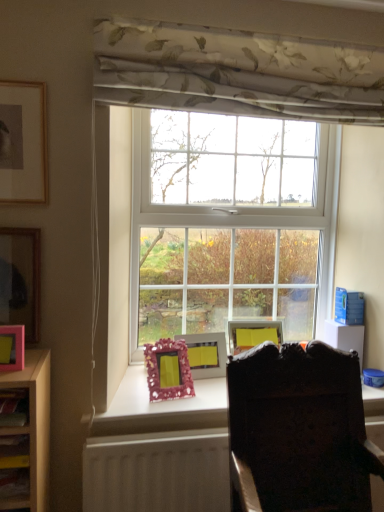
I want to click on free space above floral fabric curtain at upper center (from a real-world perspective), so click(x=245, y=24).